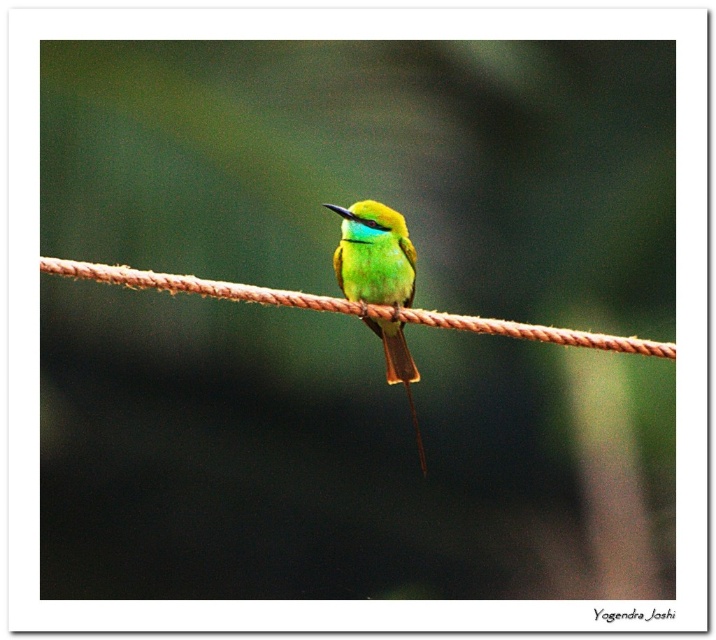
Question: Does brown rope at center appear over green glossy bird at center?

Choices:
 (A) yes
 (B) no

Answer: (B)

Question: Can you confirm if brown rope at center is positioned to the left of green glossy bird at center?

Choices:
 (A) yes
 (B) no

Answer: (A)

Question: In this image, where is brown rope at center located relative to green glossy bird at center?

Choices:
 (A) below
 (B) above

Answer: (A)

Question: Among these points, which one is nearest to the camera?

Choices:
 (A) (64, 266)
 (B) (420, 438)

Answer: (A)

Question: Which object is closer to the camera taking this photo?

Choices:
 (A) green glossy bird at center
 (B) brown rope at center

Answer: (B)